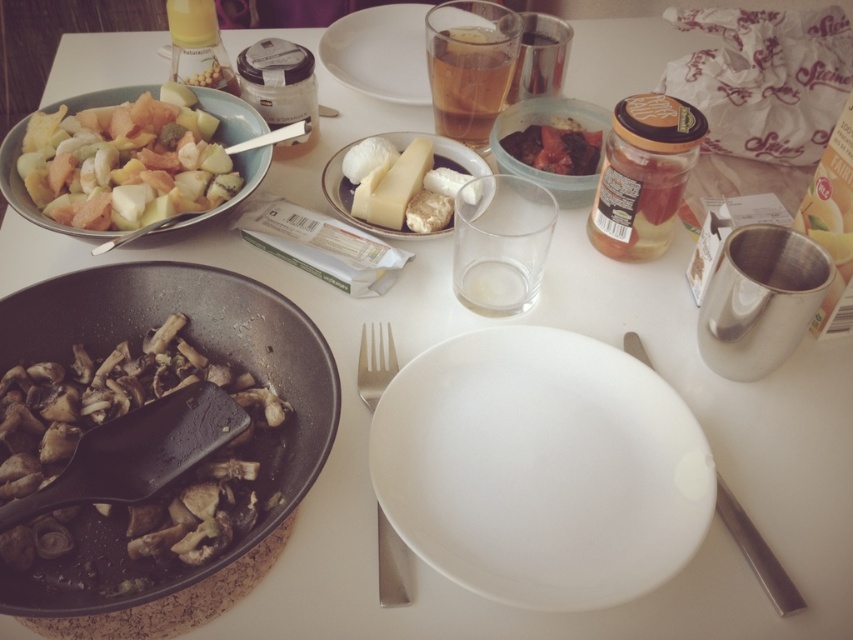
Does point (128, 593) come in front of point (410, 134)?

Yes, point (128, 593) is in front of point (410, 134).

Who is more forward, (x=225, y=557) or (x=347, y=198)?

Point (x=225, y=557) is in front.

Where is `black plastic frying pan at lower left`? The height and width of the screenshot is (640, 853). black plastic frying pan at lower left is located at coordinates (207, 356).

Between satin silver fork at center and white porcelain plate at center, which one is positioned lower?

Positioned lower is satin silver fork at center.

Measure the distance between point (x=381, y=564) and camera.

Point (x=381, y=564) and camera are 16.86 inches apart from each other.

Where is `satin silver fork at center`? This screenshot has height=640, width=853. satin silver fork at center is located at coordinates (375, 362).

The image size is (853, 640). Identify the location of satin silver fork at center. (375, 362).

Between white matte plate at center and white matte plate at upper center, which one has more height?

With more height is white matte plate at upper center.

This screenshot has height=640, width=853. Identify the location of white matte plate at center. (541, 468).

This screenshot has width=853, height=640. What are the coordinates of `white matte plate at center` in the screenshot? It's located at (541, 468).

Identify the location of white matte plate at center. The height and width of the screenshot is (640, 853). (541, 468).